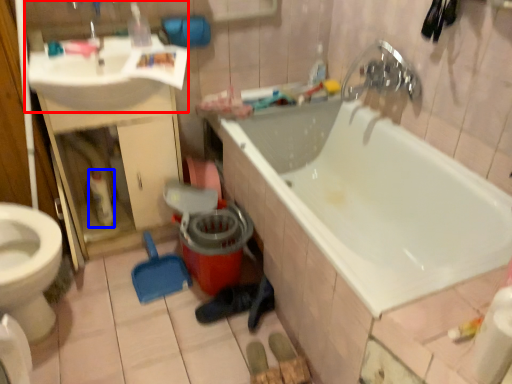
Question: Which object appears farthest to the camera in this image, sink (highlighted by a red box) or cleaning product (highlighted by a blue box)?

Choices:
 (A) sink
 (B) cleaning product

Answer: (B)